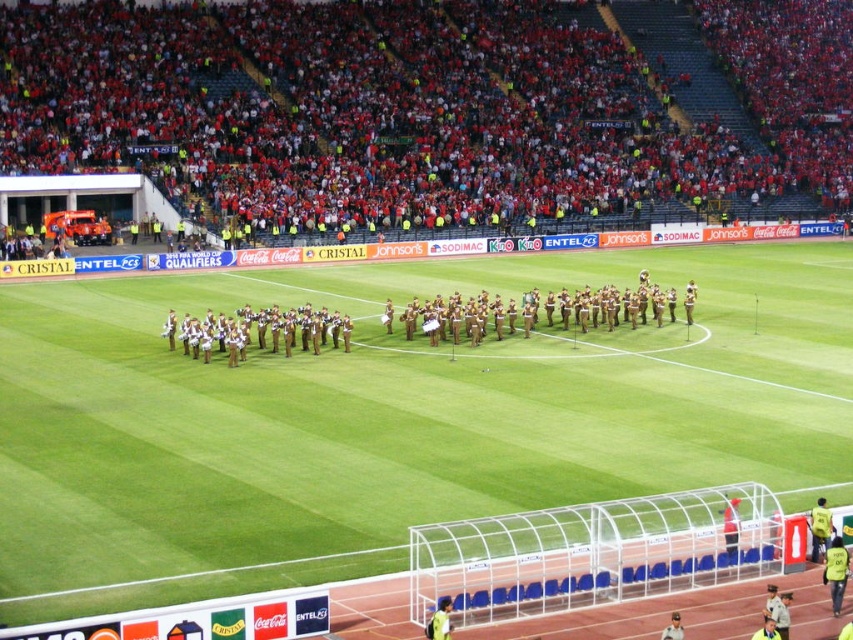
You are a photographer standing at the edge of the field. You want to take a photo that includes both the green grass football field at center and the red fabric crowd at upper center. Given that your camera can focus on objects up to 25 meters away, will both subjects be in focus?

The green grass football field at center is 22.83 meters from the red fabric crowd at upper center. Since the camera can focus up to 25 meters, both subjects will be in focus as the distance between them is within the camera range.

You are a drone operator trying to capture aerial footage of the green grass football field at center. The stadium has a restricted airspace zone that prohibits drones from entering an area within 10 meters of any point. The point you need to avoid is at coordinates point [389,417]. Is the green grass football field at center within the restricted airspace zone?

The green grass football field at center is located at point [389,417], so yes, it is within the restricted airspace zone and cannot be flown over.

You are a photographer standing at the edge of the field. You want to take a photo of the green grass football field at center. Considering the distance between you and the field, can you capture the entire field in one shot without moving your position?

The distance between you and the green grass football field at center is 18.20 meters. To determine if the entire field can be captured in one shot, you need to consider your camera lens focal length. A wide angle lens with a focal length of 24mm or lower would allow capturing the entire field from that distance.